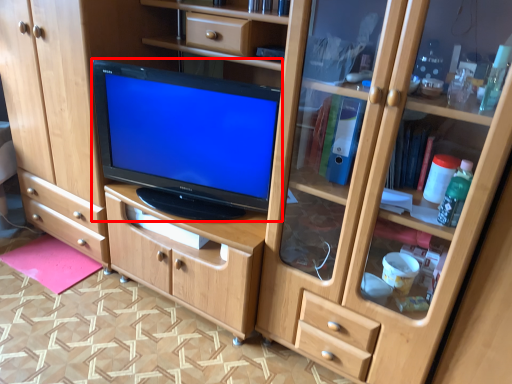
Question: Where is television (annotated by the red box) located in relation to flat in the image?

Choices:
 (A) left
 (B) right

Answer: (B)